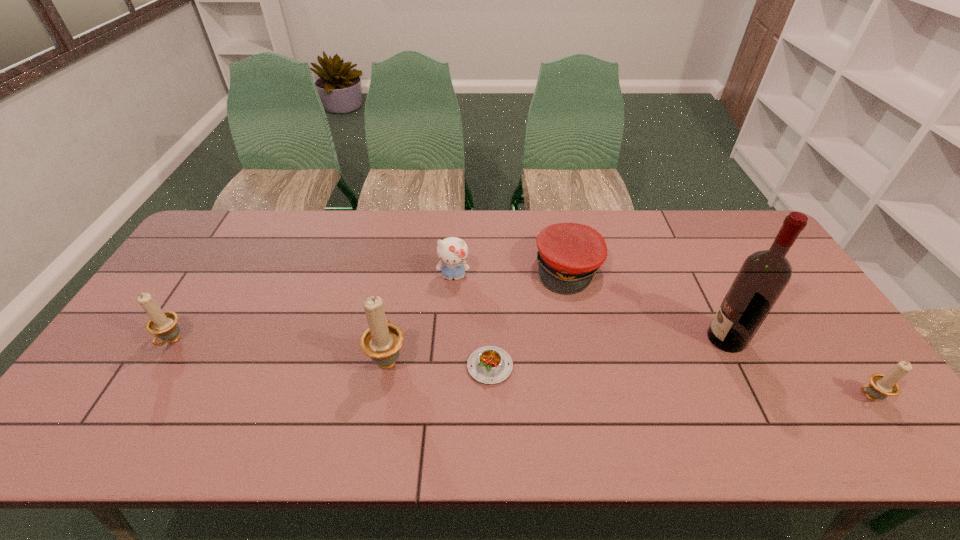
At what (x,y) coordinates should I click in order to perform the action: click on alcohol. Please return your answer as a coordinate pair (x, y). The image size is (960, 540). Looking at the image, I should click on (764, 275).

The width and height of the screenshot is (960, 540). Identify the location of the shortest object. (490, 365).

Where is `vacant space positioned 0.130m on the handle side of the leftmost object`? This screenshot has width=960, height=540. vacant space positioned 0.130m on the handle side of the leftmost object is located at coordinates (135, 401).

Locate an element on the screen. blank space located 0.280m on the handle side of the sixth shortest object is located at coordinates (404, 268).

Locate an element on the screen. This screenshot has width=960, height=540. free space located 0.190m on the handle side of the sixth shortest object is located at coordinates (401, 288).

This screenshot has width=960, height=540. Find the location of `blank space located on the handle side of the sixth shortest object`. blank space located on the handle side of the sixth shortest object is located at coordinates (402, 279).

Locate an element on the screen. This screenshot has width=960, height=540. vacant space positioned 0.350m on the handle side of the nearest candle_holder is located at coordinates (707, 397).

Locate an element on the screen. vacant area situated 0.210m on the handle side of the nearest candle_holder is located at coordinates (765, 397).

The image size is (960, 540). Identify the location of vacant space located 0.250m on the handle side of the nearest candle_holder. (749, 397).

What are the coordinates of `vacant position located 0.270m on the front-facing side of the kitten` in the screenshot? It's located at (448, 360).